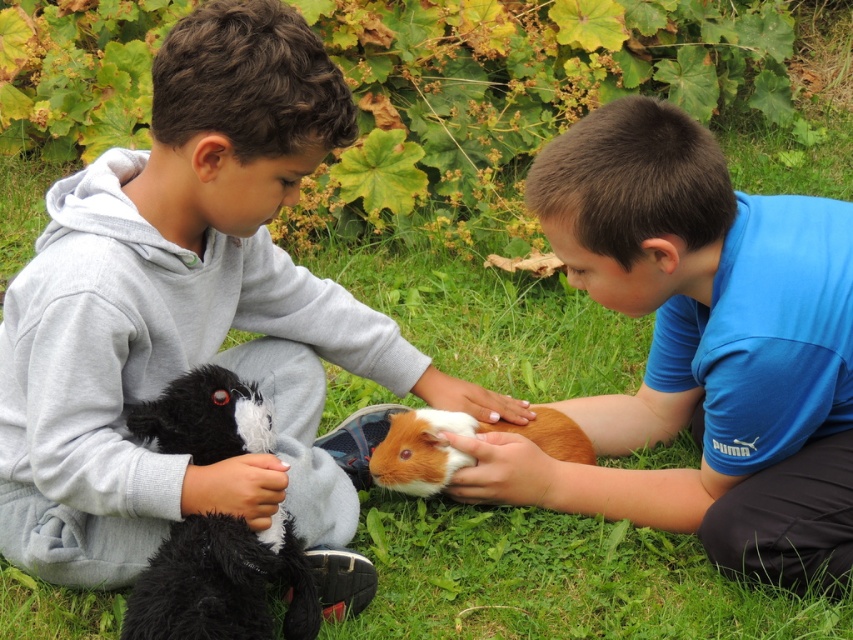
Question: Is blue cotton shirt at center smaller than black plush toy at left?

Choices:
 (A) yes
 (B) no

Answer: (B)

Question: Is soft gray hoodie at center above blue cotton shirt at center?

Choices:
 (A) no
 (B) yes

Answer: (A)

Question: Can you confirm if soft gray hoodie at center is wider than fluffy brown guinea pig at center?

Choices:
 (A) yes
 (B) no

Answer: (A)

Question: Which point is farther from the camera taking this photo?

Choices:
 (A) (231, 566)
 (B) (299, 513)
 (C) (662, 401)
 (D) (383, 472)

Answer: (C)

Question: Which point appears closest to the camera in this image?

Choices:
 (A) (544, 192)
 (B) (3, 476)

Answer: (A)

Question: Which of the following is the closest to the observer?

Choices:
 (A) blue cotton shirt at center
 (B) fluffy brown guinea pig at center

Answer: (A)